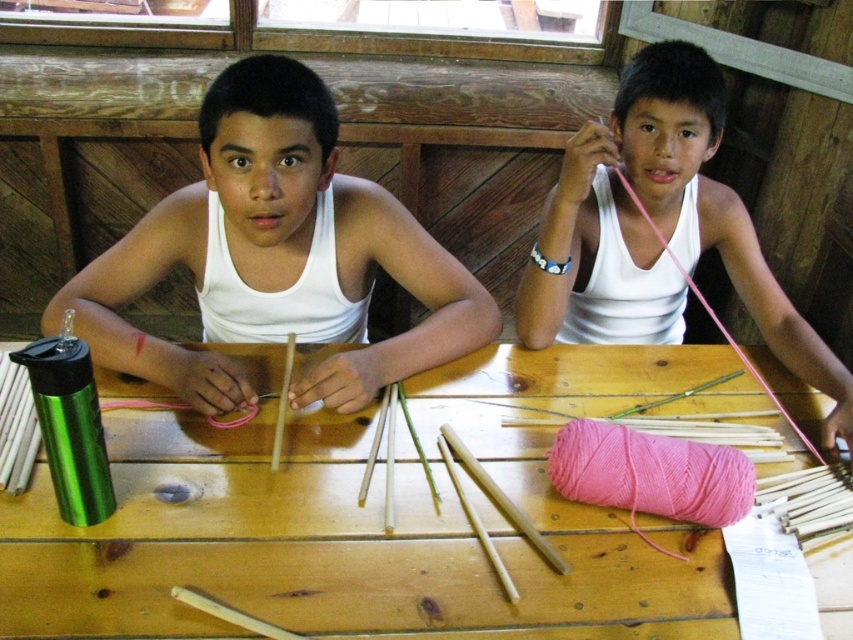
Consider the image. Between pink matte yarn at upper right and pink yarn at lower center, which one is positioned higher?

pink matte yarn at upper right is above.

Measure the distance from pink matte yarn at upper right to pink yarn at lower center.

pink matte yarn at upper right is 17.33 inches from pink yarn at lower center.

Is point (641, 102) positioned before point (585, 451)?

No, (641, 102) is further to viewer.

Find the location of a particular element. pink matte yarn at upper right is located at coordinates (668, 212).

Who is positioned more to the right, wooden table at center or pink yarn at lower center?

Positioned to the right is pink yarn at lower center.

Looking at this image, between wooden table at center and pink yarn at lower center, which one is positioned higher?

pink yarn at lower center is higher up.

Which is behind, point (643, 618) or point (733, 483)?

The point (733, 483) is behind.

The image size is (853, 640). Find the location of `wooden table at center`. wooden table at center is located at coordinates (364, 516).

In the scene shown: Is white matte tank top at center below pink yarn at lower center?

No.

From the picture: Measure the distance between white matte tank top at center and pink yarn at lower center.

white matte tank top at center and pink yarn at lower center are 19.82 inches apart from each other.

At what (x,y) coordinates should I click in order to perform the action: click on white matte tank top at center. Please return your answer as a coordinate pair (x, y). Looking at the image, I should click on (277, 250).

Locate an element on the screen. white matte tank top at center is located at coordinates (277, 250).